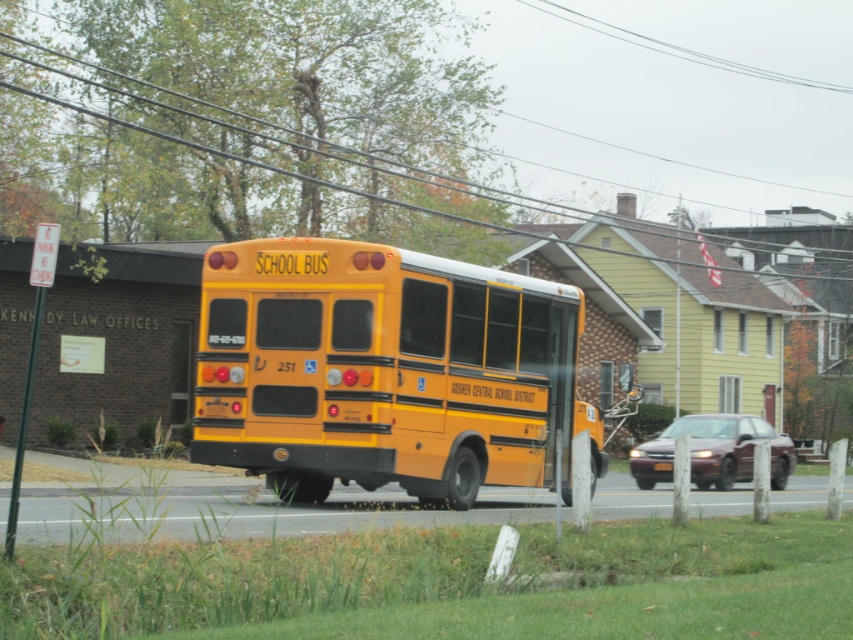
Is point (86, 109) farther from viewer compared to point (633, 461)?

That is False.

Which is below, black wire at upper center or maroon glossy sedan at center?

Positioned lower is maroon glossy sedan at center.

I want to click on black wire at upper center, so click(286, 132).

Looking at this image, who is shorter, yellow matte school bus at center or maroon glossy sedan at center?

maroon glossy sedan at center is shorter.

In the scene shown: Is yellow matte school bus at center taller than maroon glossy sedan at center?

Yes, yellow matte school bus at center is taller than maroon glossy sedan at center.

Where is `yellow matte school bus at center`? yellow matte school bus at center is located at coordinates (386, 371).

Between yellow matte school bus at center and black wire at upper center, which one appears on the left side from the viewer's perspective?

yellow matte school bus at center is more to the left.

Which of these two, yellow matte school bus at center or black wire at upper center, stands shorter?

yellow matte school bus at center

Between point (315, 468) and point (347, 186), which one is positioned in front?

Point (315, 468) is more forward.

Find the location of `yellow matte school bus at center`. yellow matte school bus at center is located at coordinates (386, 371).